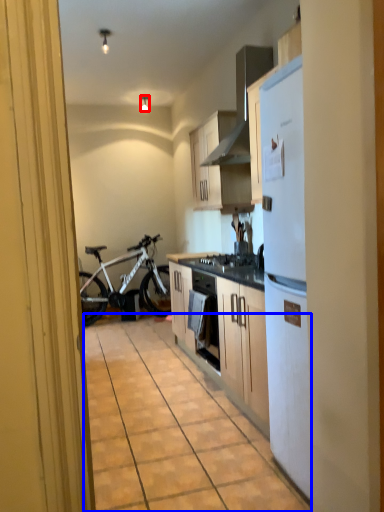
Question: Which of the following is the closest to the observer, lamp (highlighted by a red box) or alley (highlighted by a blue box)?

Choices:
 (A) lamp
 (B) alley

Answer: (B)